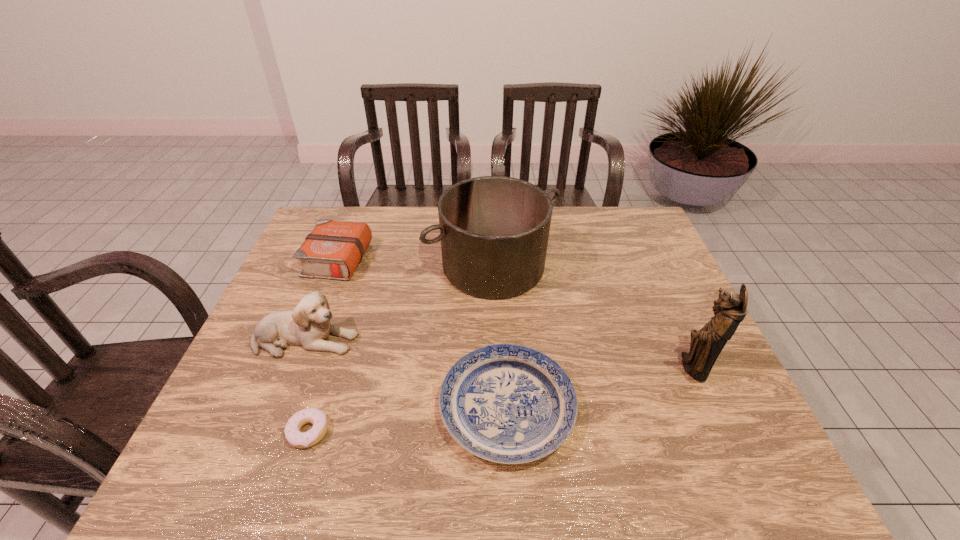
Where is `vacant area situated on the right of the second tallest object`? The image size is (960, 540). vacant area situated on the right of the second tallest object is located at coordinates (575, 266).

You are a GUI agent. You are given a task and a screenshot of the screen. Output one action in this format:
    pyautogui.click(x=<x>, y=<y>)
    Task: Click on the vacant space located 0.320m on the front-facing side of the fourth shortest object
    The width and height of the screenshot is (960, 540).
    Given the screenshot: What is the action you would take?
    pyautogui.click(x=482, y=339)

At what (x,y) coordinates should I click in order to perform the action: click on vacant space located on the front of the Bible. Please return your answer as a coordinate pair (x, y). The height and width of the screenshot is (540, 960). Looking at the image, I should click on (303, 342).

This screenshot has height=540, width=960. In order to click on vacant space situated 0.390m on the back of the plate in this screenshot , I will do `click(499, 258)`.

You are a GUI agent. You are given a task and a screenshot of the screen. Output one action in this format:
    pyautogui.click(x=<x>, y=<y>)
    Task: Click on the vacant space located on the back of the doughnut
    This screenshot has width=960, height=540.
    Given the screenshot: What is the action you would take?
    pyautogui.click(x=349, y=303)

The width and height of the screenshot is (960, 540). In order to click on pan located at the far edge in this screenshot , I will do `click(494, 230)`.

Where is `Bible that is at the far edge`? The width and height of the screenshot is (960, 540). Bible that is at the far edge is located at coordinates (333, 250).

Identify the location of plate that is positioned at the near edge. This screenshot has height=540, width=960. (506, 403).

Where is `doughnut that is positioned at the near edge`? The image size is (960, 540). doughnut that is positioned at the near edge is located at coordinates [x=296, y=438].

Image resolution: width=960 pixels, height=540 pixels. In order to click on puppy present at the left edge in this screenshot , I will do `click(308, 325)`.